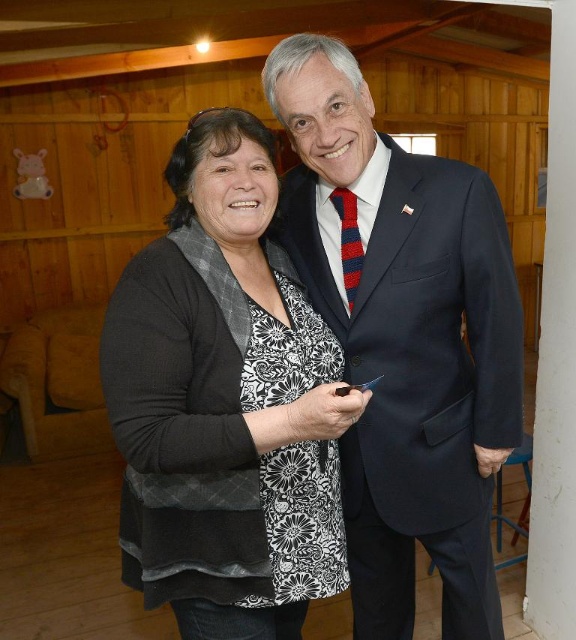
Question: Among these points, which one is nearest to the camera?

Choices:
 (A) (513, 280)
 (B) (350, 262)
 (C) (138, 307)

Answer: (C)

Question: Which object appears closest to the camera in this image?

Choices:
 (A) red striped tie at center
 (B) dark blue suit at center
 (C) black textured cardigan at center

Answer: (C)

Question: Which point is farther from the camera taking this photo?

Choices:
 (A) (213, 461)
 (B) (449, 589)

Answer: (B)

Question: Is black textured cardigan at center above red striped tie at center?

Choices:
 (A) yes
 (B) no

Answer: (B)

Question: Is black textured cardigan at center smaller than dark blue suit at center?

Choices:
 (A) no
 (B) yes

Answer: (B)

Question: Is black textured cardigan at center to the right of dark blue suit at center from the viewer's perspective?

Choices:
 (A) no
 (B) yes

Answer: (A)